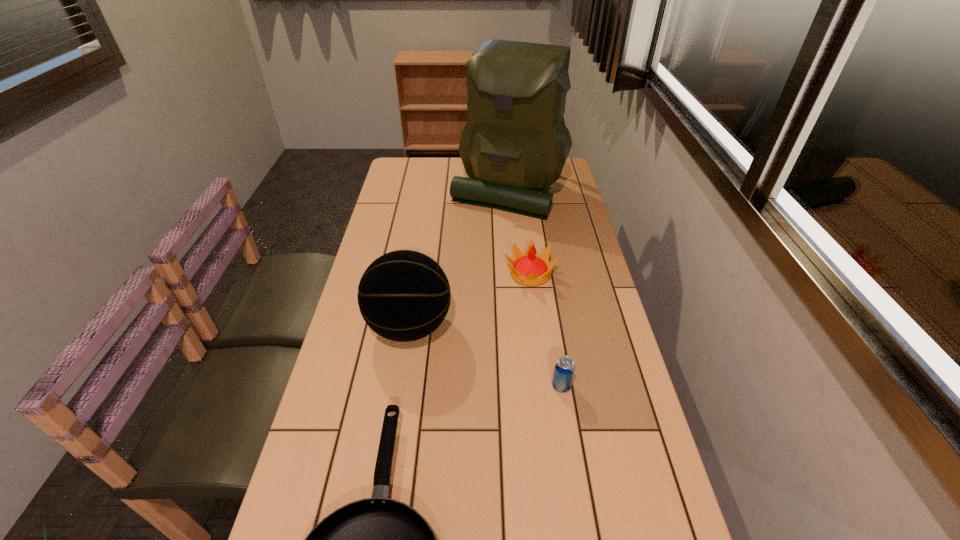
The height and width of the screenshot is (540, 960). In order to click on object identified as the second closest to the frying pan in this screenshot , I will do `click(564, 369)`.

Where is `blank area in the image that satisfies the following two spatial constraints: 1. on the front of the farthest object with visible pockets; 2. on the right side of the beer can`? This screenshot has height=540, width=960. blank area in the image that satisfies the following two spatial constraints: 1. on the front of the farthest object with visible pockets; 2. on the right side of the beer can is located at coordinates (525, 386).

I want to click on vacant space that satisfies the following two spatial constraints: 1. on the front of the farthest object with visible pockets; 2. on the right side of the beer can, so click(x=525, y=386).

Locate an element on the screen. The width and height of the screenshot is (960, 540). blank space that satisfies the following two spatial constraints: 1. on the front of the backpack with visible pockets; 2. on the left side of the beer can is located at coordinates (525, 386).